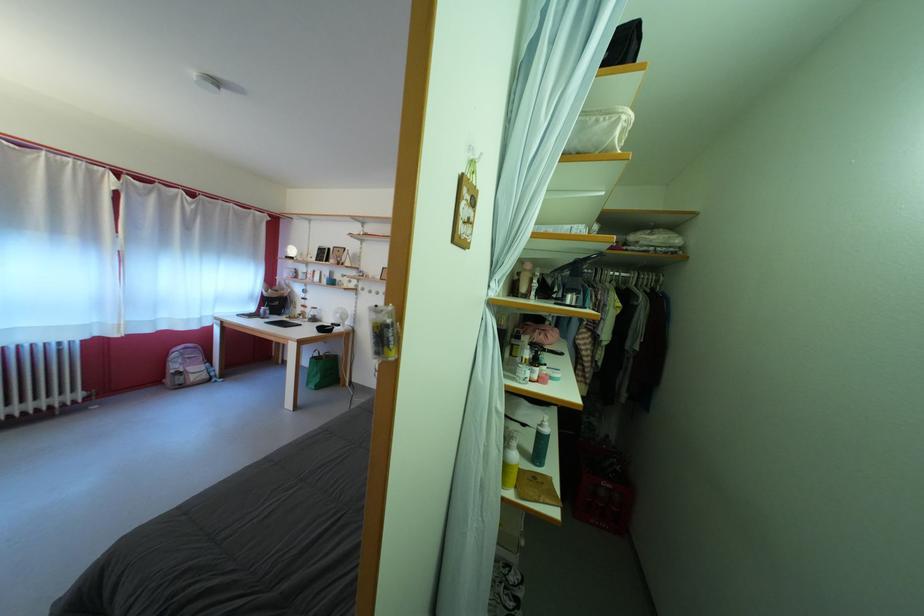
What do you see at coordinates (543, 424) in the screenshot? The image size is (924, 616). I see `the dropper bottle cap` at bounding box center [543, 424].